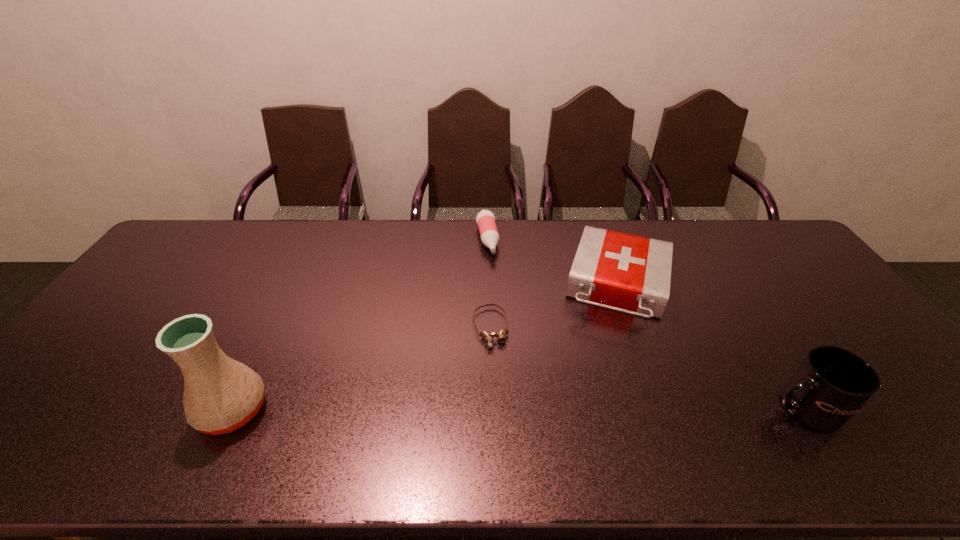
Where is `the leftmost object`? the leftmost object is located at coordinates (221, 395).

This screenshot has width=960, height=540. In order to click on pottery in this screenshot , I will do `click(221, 395)`.

Where is `mug`? The image size is (960, 540). mug is located at coordinates (831, 384).

Find the location of a particular element. The image size is (960, 540). the rightmost object is located at coordinates (831, 384).

This screenshot has height=540, width=960. I want to click on the third shortest object, so click(x=624, y=272).

In order to click on the first-aid kit in this screenshot , I will do `click(624, 272)`.

Locate an element on the screen. The height and width of the screenshot is (540, 960). the second shortest object is located at coordinates (485, 219).

This screenshot has width=960, height=540. I want to click on the shortest object, so click(x=501, y=335).

What are the coordinates of `vacant space situated on the back of the pottery` in the screenshot? It's located at (274, 325).

Identify the location of free space located with the handle on the side of the fourth shortest object. (707, 408).